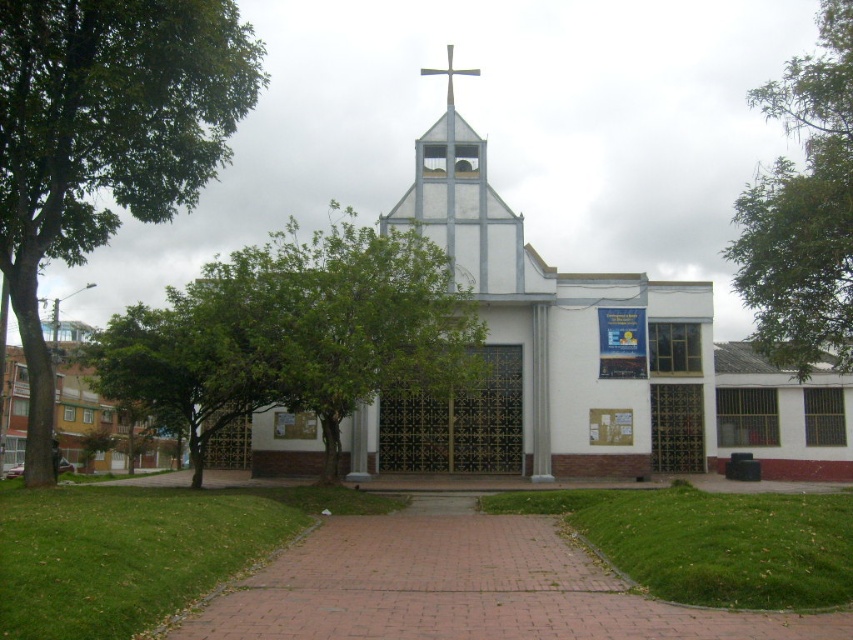
You are standing at the entrance of the modern church and want to walk towards the silver metallic cross at center. Which direction should you go relative to the brick pathway at center?

Since the brick pathway at center is closer to the viewer than the silver metallic cross at center, you should walk forward along the brick pathway at center towards the cross.

You are a visitor approaching the church and need to walk along the brick pathway at center. Is there any obstruction blocking your path due to the green leafy tree at center?

The green leafy tree at center is positioned over the brick pathway at center, so it may cast shade but does not physically block your path.